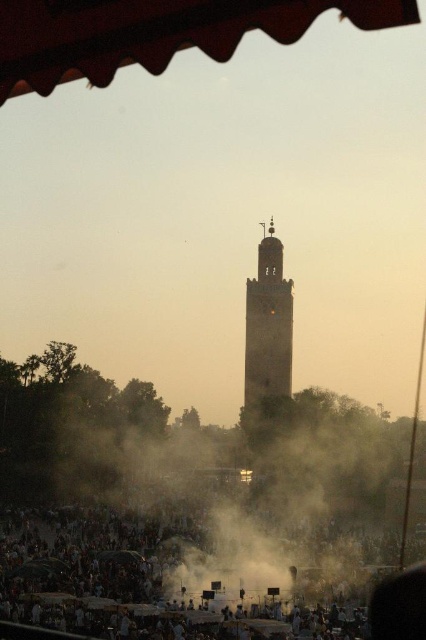
Which is in front, point (117, 586) or point (271, 365)?

Point (271, 365)

Between dark brown fabric crowd at lower center and brown stone tower at center, which one appears on the left side from the viewer's perspective?

From the viewer's perspective, dark brown fabric crowd at lower center appears more on the left side.

At what (x,y) coordinates should I click in order to perform the action: click on dark brown fabric crowd at lower center. Please return your answer as a coordinate pair (x, y). Looking at the image, I should click on pos(134,586).

Locate an element on the screen. dark brown fabric crowd at lower center is located at coordinates (134, 586).

Between dark brown fabric crowd at lower center and wooden textured awning at upper center, which one is positioned higher?

wooden textured awning at upper center is higher up.

Who is more distant from viewer, (127, 524) or (58, 68)?

The point (127, 524) is more distant.

You are a GUI agent. You are given a task and a screenshot of the screen. Output one action in this format:
    pyautogui.click(x=<x>, y=<y>)
    Task: Click on the dark brown fabric crowd at lower center
    This screenshot has width=426, height=640.
    Given the screenshot: What is the action you would take?
    pyautogui.click(x=134, y=586)

Is the position of wooden textured awning at upper center less distant than that of brown stone tower at center?

Yes, it is.

Who is higher up, wooden textured awning at upper center or brown stone tower at center?

wooden textured awning at upper center

Which is behind, point (370, 19) or point (259, 380)?

The point (259, 380) is behind.

Where is `wooden textured awning at upper center`? The height and width of the screenshot is (640, 426). wooden textured awning at upper center is located at coordinates (154, 33).